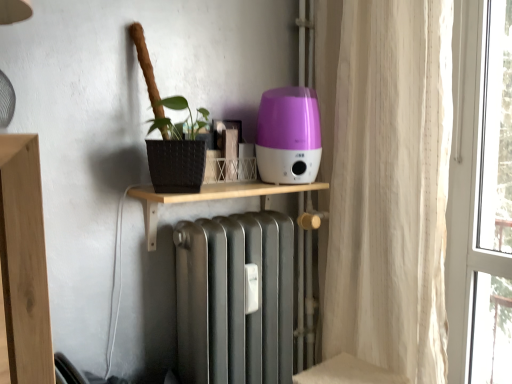
Question: Considering the relative positions of wooden shelf at center and purple glossy humidifier at center in the image provided, is wooden shelf at center behind purple glossy humidifier at center?

Choices:
 (A) no
 (B) yes

Answer: (A)

Question: Does wooden shelf at center have a greater width compared to purple glossy humidifier at center?

Choices:
 (A) yes
 (B) no

Answer: (A)

Question: Is purple glossy humidifier at center at the back of wooden shelf at center?

Choices:
 (A) yes
 (B) no

Answer: (B)

Question: Can you confirm if wooden shelf at center is positioned to the right of purple glossy humidifier at center?

Choices:
 (A) no
 (B) yes

Answer: (A)

Question: From a real-world perspective, is wooden shelf at center beneath purple glossy humidifier at center?

Choices:
 (A) no
 (B) yes

Answer: (B)

Question: Relative to purple glossy humidifier at center, is white sheer curtain at right in front or behind?

Choices:
 (A) front
 (B) behind

Answer: (A)

Question: Considering the positions of white sheer curtain at right and purple glossy humidifier at center in the image, is white sheer curtain at right bigger or smaller than purple glossy humidifier at center?

Choices:
 (A) big
 (B) small

Answer: (A)

Question: Do you think white sheer curtain at right is within purple glossy humidifier at center, or outside of it?

Choices:
 (A) inside
 (B) outside

Answer: (B)

Question: Is white sheer curtain at right taller or shorter than purple glossy humidifier at center?

Choices:
 (A) tall
 (B) short

Answer: (A)

Question: Do you think wooden shelf at center is within purple glossy humidifier at center, or outside of it?

Choices:
 (A) inside
 (B) outside

Answer: (B)

Question: Is wooden shelf at center in front of or behind purple glossy humidifier at center in the image?

Choices:
 (A) behind
 (B) front

Answer: (B)

Question: Considering the positions of point (237, 188) and point (260, 140), is point (237, 188) closer or farther from the camera than point (260, 140)?

Choices:
 (A) farther
 (B) closer

Answer: (B)

Question: From a real-world perspective, is wooden shelf at center positioned above or below purple glossy humidifier at center?

Choices:
 (A) above
 (B) below

Answer: (B)

Question: Do you think purple glossy humidifier at center is within white sheer curtain at right, or outside of it?

Choices:
 (A) outside
 (B) inside

Answer: (A)

Question: Considering the positions of purple glossy humidifier at center and white sheer curtain at right in the image, is purple glossy humidifier at center taller or shorter than white sheer curtain at right?

Choices:
 (A) short
 (B) tall

Answer: (A)